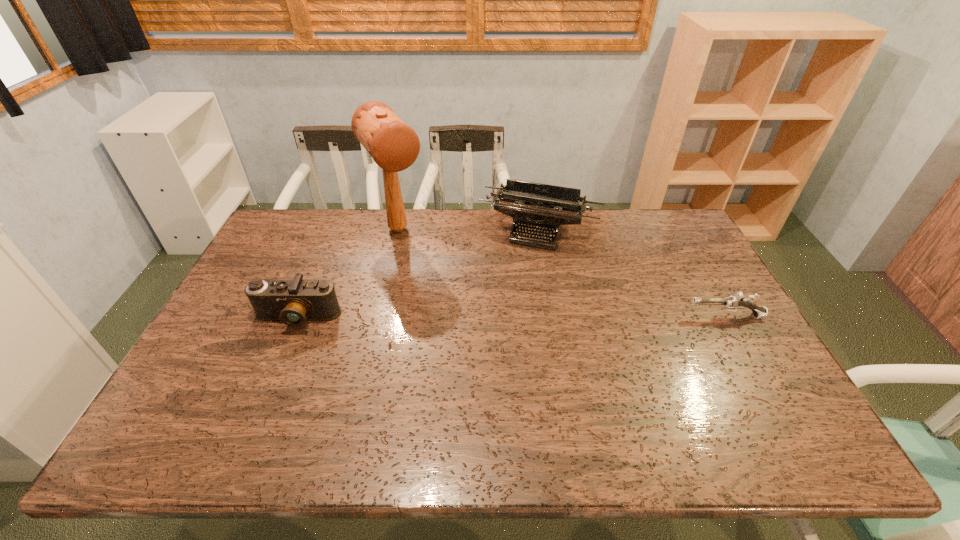
This screenshot has height=540, width=960. Find the location of `empty space between the third tallest object and the third shortest object`. empty space between the third tallest object and the third shortest object is located at coordinates (419, 274).

Identify the location of free spot between the camera and the shortest object. The image size is (960, 540). (512, 317).

Identify the location of vacant space that is in between the third shortest object and the gun. The width and height of the screenshot is (960, 540). (633, 273).

The image size is (960, 540). I want to click on vacant space that's between the tallest object and the second object from right to left, so click(x=468, y=230).

What are the coordinates of `free space between the rightmost object and the camera` in the screenshot? It's located at (512, 317).

Identify the location of unoccupied position between the typewriter and the gun. (633, 273).

Identify which object is the second nearest to the second tallest object. Please provide its 2D coordinates. Your answer should be formatted as a tuple, i.e. [(x, y)], where the tuple contains the x and y coordinates of a point satisfying the conditions above.

[(732, 303)]

The height and width of the screenshot is (540, 960). Find the location of `object that ranks as the third closest to the camera`. object that ranks as the third closest to the camera is located at coordinates click(732, 303).

Where is `free space that satisfies the following two spatial constraints: 1. on the front side of the second tallest object; 2. aimed along the barrel of the gun`? free space that satisfies the following two spatial constraints: 1. on the front side of the second tallest object; 2. aimed along the barrel of the gun is located at coordinates (554, 316).